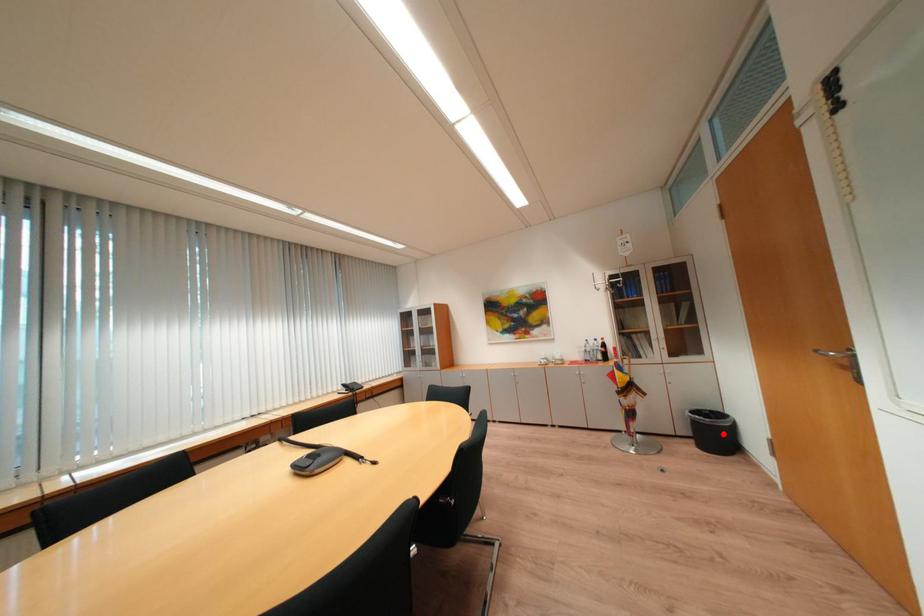
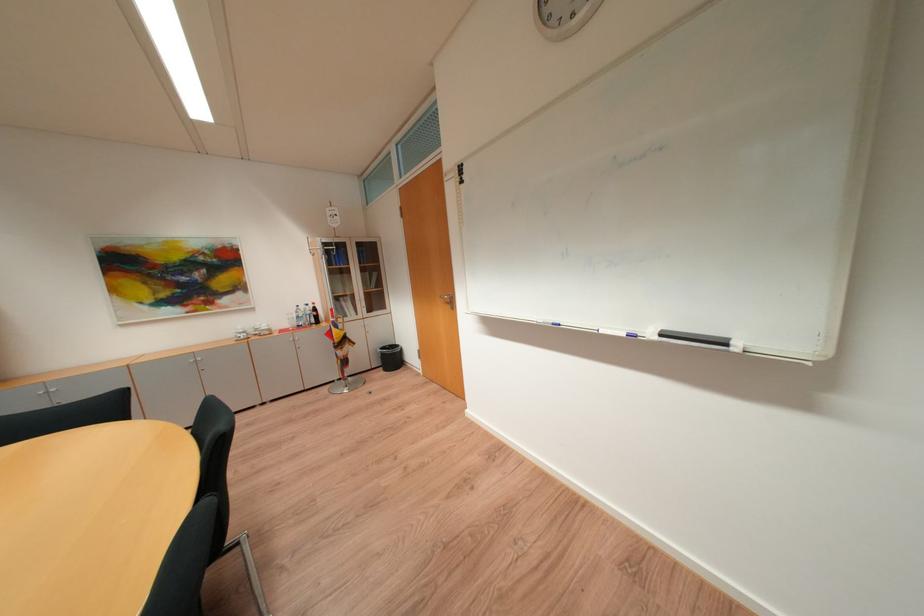
Where in the second image is the point corresponding to the highlighted location from the first image?

(400, 360)